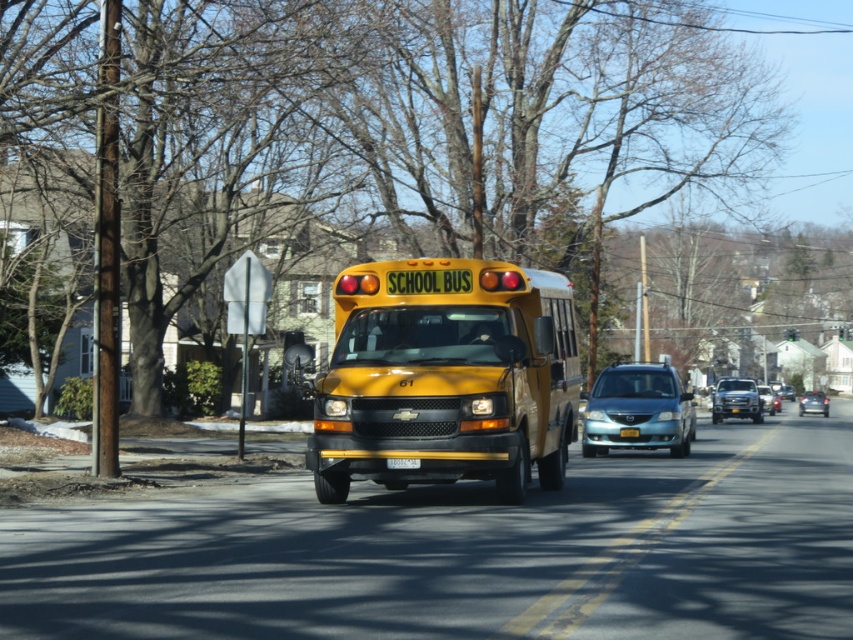
Question: Which point appears closest to the camera in this image?

Choices:
 (A) (820, 412)
 (B) (773, 403)
 (C) (340, 461)

Answer: (C)

Question: Which point is farther to the camera?

Choices:
 (A) metallic blue sedan at center
 (B) metallic silver sedan at center

Answer: (B)

Question: Based on their relative distances, which object is nearer to the metallic blue minivan at center?

Choices:
 (A) metallic silver sedan at center
 (B) metallic blue sedan at center
 (C) yellow matte school bus at center

Answer: (C)

Question: Is yellow matte school bus at center positioned before metallic silver sedan at center?

Choices:
 (A) yes
 (B) no

Answer: (A)

Question: Is the position of yellow matte school bus at center more distant than that of metallic blue minivan at center?

Choices:
 (A) yes
 (B) no

Answer: (B)

Question: Does metallic blue minivan at center have a lesser width compared to metallic silver truck at center?

Choices:
 (A) no
 (B) yes

Answer: (B)